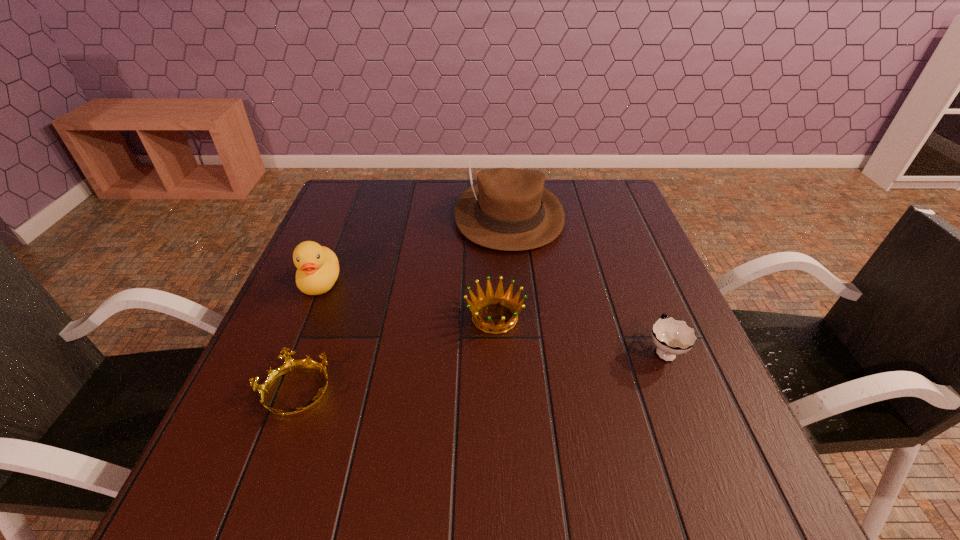
Identify the location of the tallest object. The height and width of the screenshot is (540, 960). (509, 209).

Find the location of a particular element. This screenshot has width=960, height=540. fedora is located at coordinates (509, 209).

You are a GUI agent. You are given a task and a screenshot of the screen. Output one action in this format:
    pyautogui.click(x=<x>, y=<y>)
    Task: Click on the fourth shortest object
    
    Given the screenshot: What is the action you would take?
    pyautogui.click(x=318, y=268)

You are a GUI agent. You are given a task and a screenshot of the screen. Output one action in this format:
    pyautogui.click(x=<x>, y=<y>)
    Task: Click on the rightmost object
    
    Given the screenshot: What is the action you would take?
    pyautogui.click(x=672, y=337)

Locate an element on the screen. This screenshot has width=960, height=540. the taller crown is located at coordinates (489, 297).

Where is `the farther crown`? the farther crown is located at coordinates (489, 297).

In order to click on the shortest object in this screenshot , I will do `click(290, 365)`.

Locate an element on the screen. the nearer crown is located at coordinates (290, 365).

This screenshot has width=960, height=540. In order to click on vacant space located 0.260m on the feather side of the tallest object in this screenshot , I will do `click(519, 328)`.

Find the location of a particular element. free spot located 0.060m at the beak of the duck is located at coordinates point(304,321).